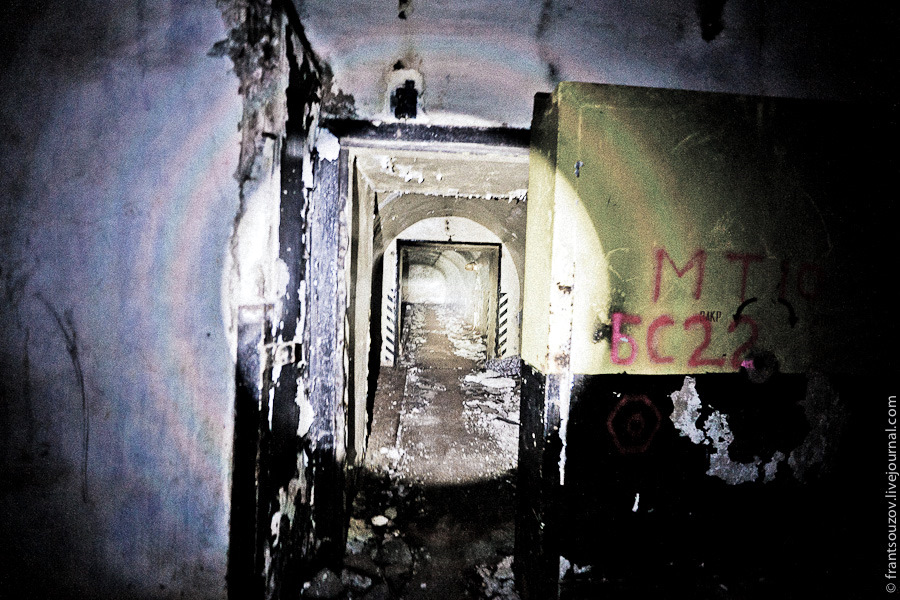
I want to click on gray wall and ceiling, so (x=518, y=19).